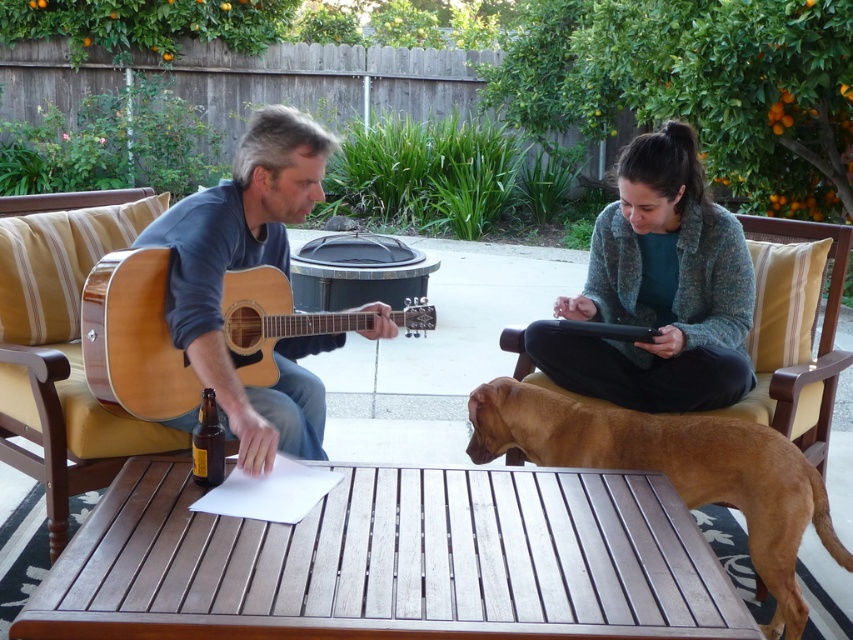
You are organizing a small outdoor concert in this backyard patio. You need to place a 1.2 meter tall amplifier between the green textured sweater at upper right and the matte wood guitar at left. Can the amplifier fit vertically between them?

The green textured sweater at upper right is shorter than the matte wood guitar at left, but the exact height difference isn not specified. Without knowing the exact heights, it is impossible to determine if the 1.2 meter amplifier can fit vertically between them.

You are organizing a small outdoor concert in this backyard patio. You need to place a decorative wreath that must be larger than the green textured sweater at upper right. Can the matte wood guitar at left be used as a base for the wreath?

The green textured sweater at upper right is smaller than the matte wood guitar at left. Since the wreath needs to be larger than the sweater, the matte wood guitar at left can serve as a suitable base because it is larger in size.